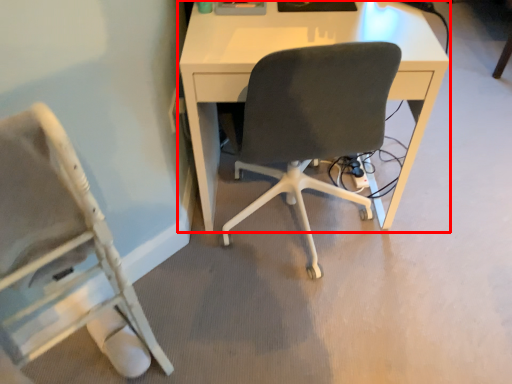
Question: From the image's perspective, where is desk (annotated by the red box) located relative to chair?

Choices:
 (A) above
 (B) below

Answer: (A)